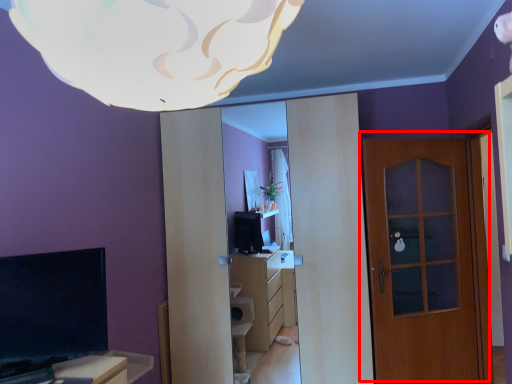
Question: From the image's perspective, where is door (annotated by the red box) located relative to lamp?

Choices:
 (A) above
 (B) below

Answer: (B)